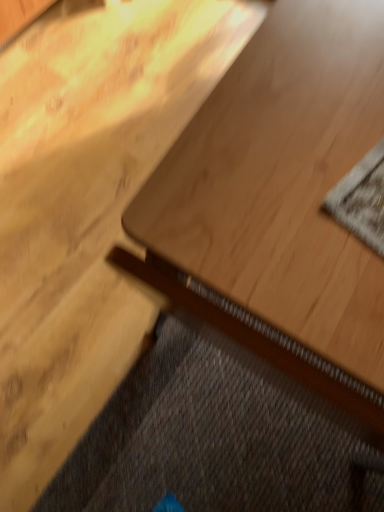
Question: From a real-world perspective, is light wood table at center on dark gray textured doormat at lower left?

Choices:
 (A) no
 (B) yes

Answer: (B)

Question: Is light wood table at center behind dark gray textured doormat at lower left?

Choices:
 (A) no
 (B) yes

Answer: (A)

Question: Considering the relative sizes of light wood table at center and dark gray textured doormat at lower left in the image provided, is light wood table at center shorter than dark gray textured doormat at lower left?

Choices:
 (A) no
 (B) yes

Answer: (A)

Question: Can you see light wood table at center touching dark gray textured doormat at lower left?

Choices:
 (A) no
 (B) yes

Answer: (A)

Question: Can you confirm if light wood table at center is bigger than dark gray textured doormat at lower left?

Choices:
 (A) yes
 (B) no

Answer: (A)

Question: Is light wood table at center far from dark gray textured doormat at lower left?

Choices:
 (A) no
 (B) yes

Answer: (A)

Question: Is dark gray textured doormat at lower left at the left side of textured gray mat at upper right?

Choices:
 (A) no
 (B) yes

Answer: (B)

Question: Is dark gray textured doormat at lower left looking in the opposite direction of textured gray mat at upper right?

Choices:
 (A) no
 (B) yes

Answer: (A)

Question: Is textured gray mat at upper right surrounded by dark gray textured doormat at lower left?

Choices:
 (A) no
 (B) yes

Answer: (A)

Question: Considering the relative sizes of dark gray textured doormat at lower left and textured gray mat at upper right in the image provided, is dark gray textured doormat at lower left wider than textured gray mat at upper right?

Choices:
 (A) yes
 (B) no

Answer: (A)

Question: Is dark gray textured doormat at lower left taller than textured gray mat at upper right?

Choices:
 (A) no
 (B) yes

Answer: (B)

Question: Is dark gray textured doormat at lower left positioned before textured gray mat at upper right?

Choices:
 (A) yes
 (B) no

Answer: (B)

Question: Is light wood table at center positioned far away from textured gray mat at upper right?

Choices:
 (A) no
 (B) yes

Answer: (A)